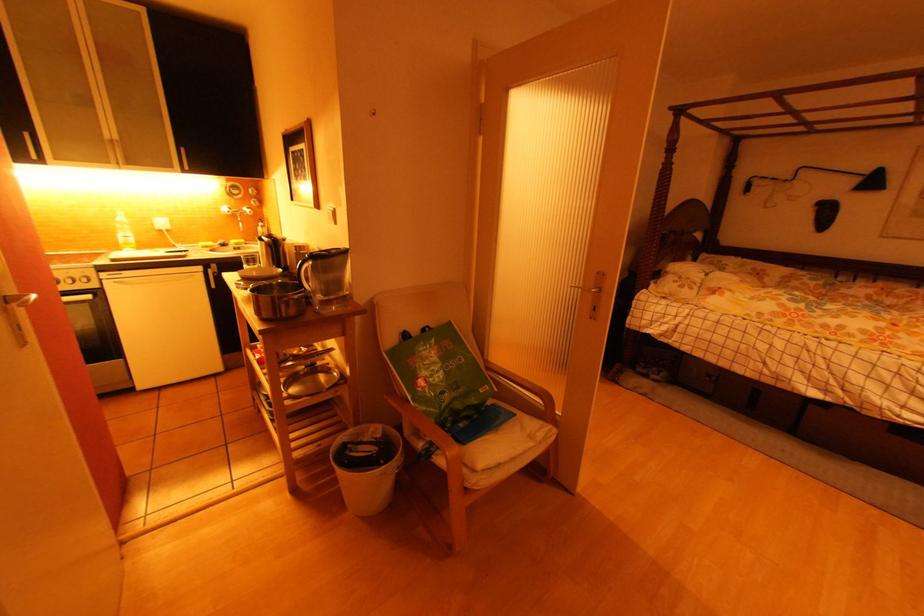
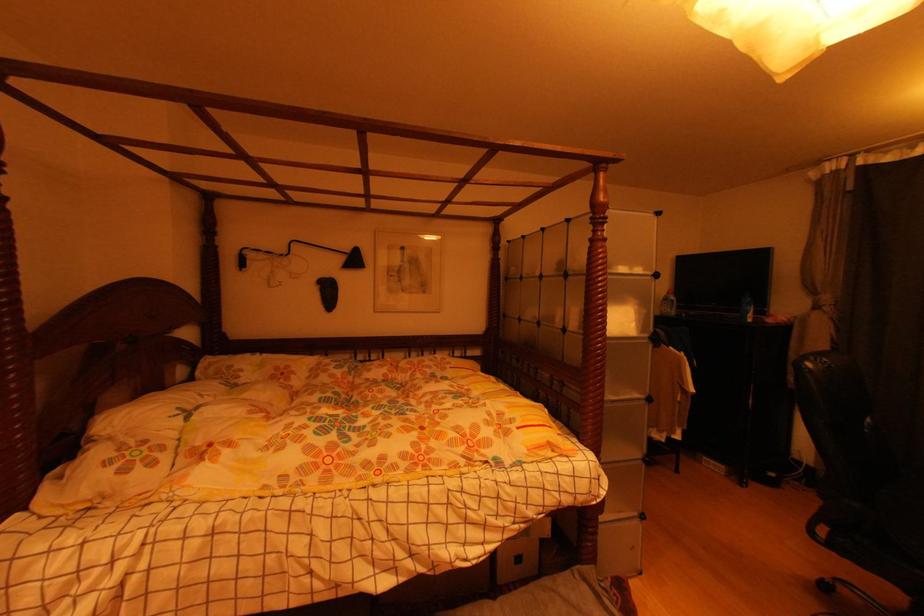
Find the pixel in the second image that matches the point at 860,182 in the first image.

(346, 261)